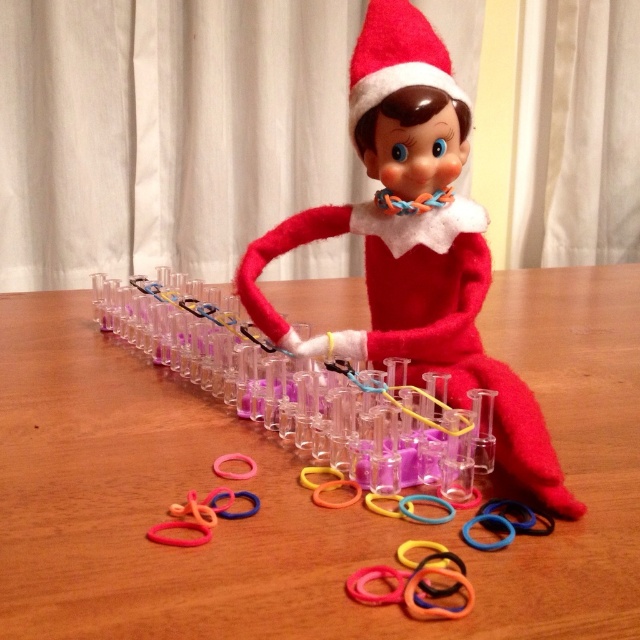
This screenshot has height=640, width=640. In order to click on rubber band at lower center in this screenshot , I will do `click(200, 516)`.

Is rubber band at lower center smaller than rubber band rubber at lower center?

Incorrect, rubber band at lower center is not smaller in size than rubber band rubber at lower center.

Locate an element on the screen. The image size is (640, 640). rubber band at lower center is located at coordinates (200, 516).

Which is more to the left, velvet red elf at center or rubber band at lower center?

From the viewer's perspective, rubber band at lower center appears more on the left side.

From the picture: Is velvet red elf at center positioned in front of rubber band at lower center?

No, it is behind rubber band at lower center.

Who is more forward, (x=509, y=477) or (x=182, y=544)?

Point (x=182, y=544)

Find the location of a particular element. This screenshot has height=640, width=640. velvet red elf at center is located at coordinates (413, 243).

Who is positioned more to the left, rubber band at center or rubber band rubber at lower center?

rubber band at center

Is point (372, 593) less distant than point (524, 518)?

Yes, point (372, 593) is closer to viewer.

Where is `rubber band at center`? The image size is (640, 640). rubber band at center is located at coordinates (417, 586).